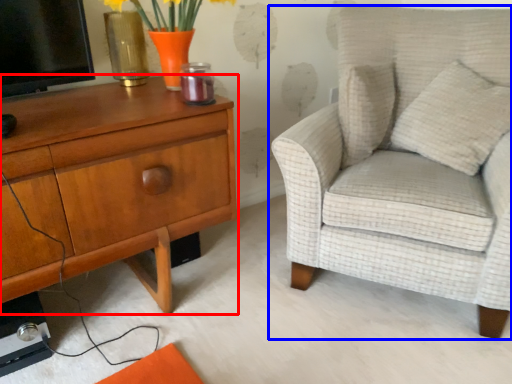
Question: Among these objects, which one is nearest to the camera, nightstand (highlighted by a red box) or chair (highlighted by a blue box)?

Choices:
 (A) nightstand
 (B) chair

Answer: (A)